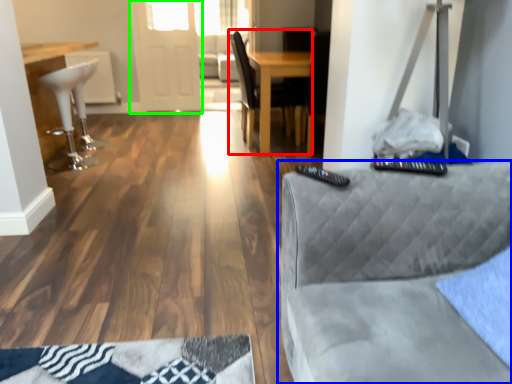
Question: Estimate the real-world distances between objects in this image. Which object is closer to chair (highlighted by a red box), studio couch (highlighted by a blue box) or glass door (highlighted by a green box)?

Choices:
 (A) studio couch
 (B) glass door

Answer: (B)